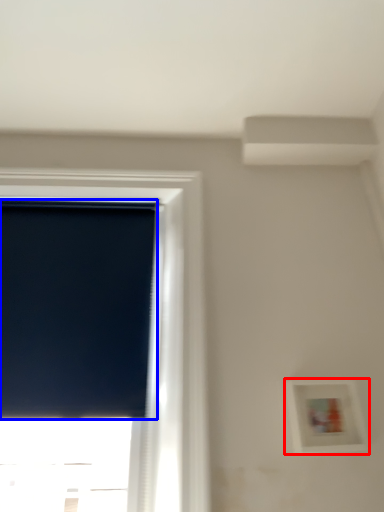
Question: Which object is closer to the camera taking this photo, picture frame (highlighted by a red box) or window screen (highlighted by a blue box)?

Choices:
 (A) picture frame
 (B) window screen

Answer: (A)